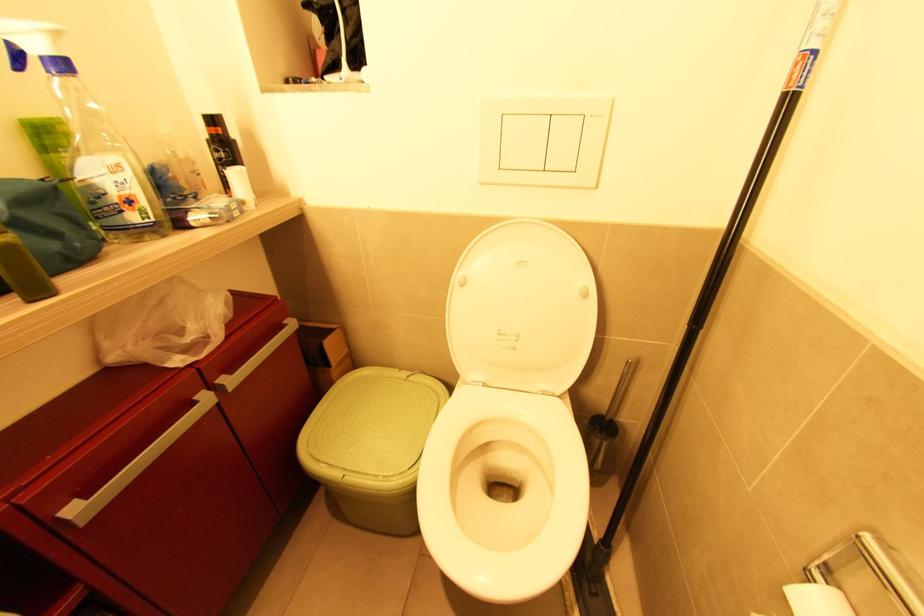
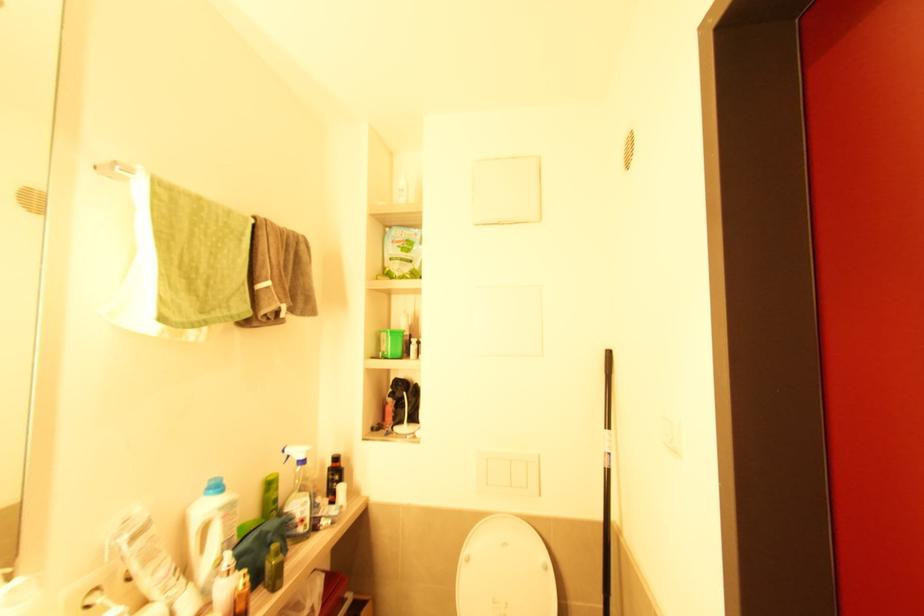
Locate, in the second image, the point that corresponds to (66,69) in the first image.

(305, 462)